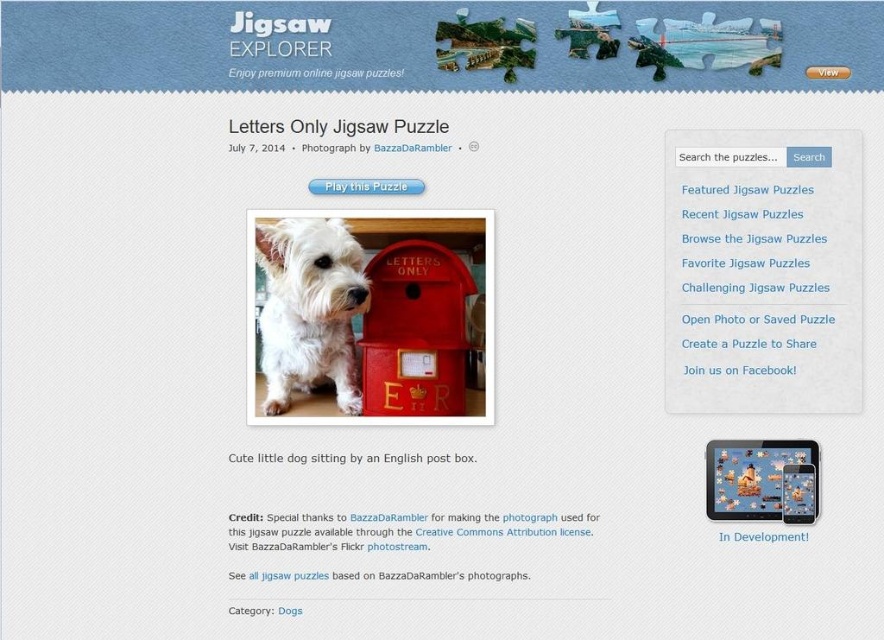
You are designing a layout for a webpage and need to place the red matte mailbox at center and the in development paper at center next to each other. Based on their widths, which one should be placed first to ensure they fit side by side without overlapping?

The red matte mailbox at center might be wider than in development paper at center, so it should be placed first to ensure they fit side by side without overlapping.